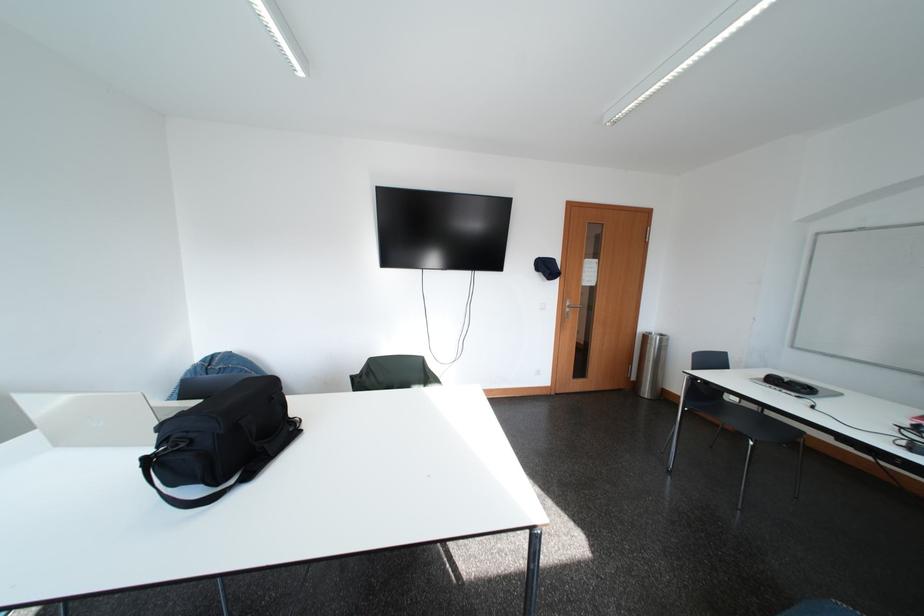
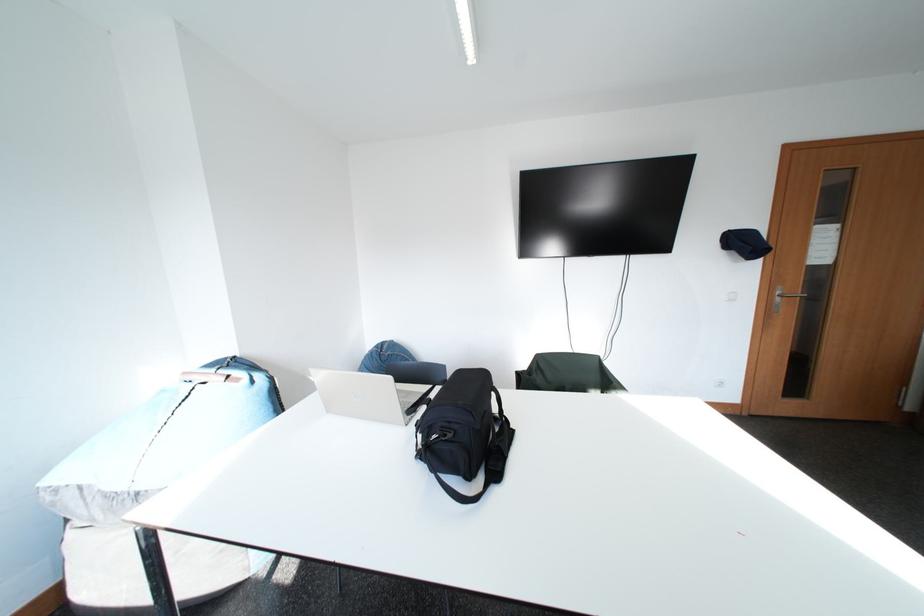
Question: The first image is from the beginning of the video and the second image is from the end. How did the camera likely rotate when shooting the video?

Choices:
 (A) Left
 (B) Right
 (C) Up
 (D) Down

Answer: (A)